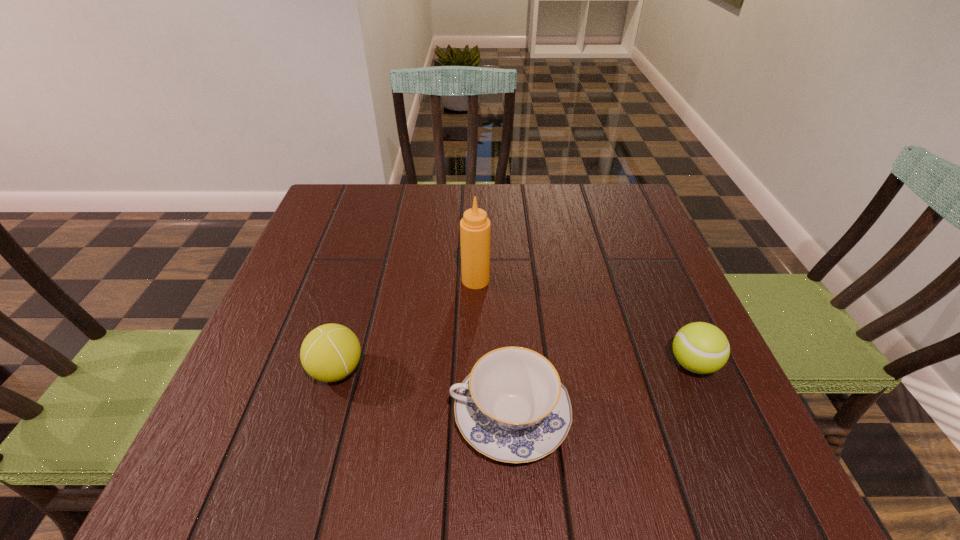
Locate an element on the screen. The image size is (960, 540). free region that satisfies the following two spatial constraints: 1. on the front side of the condiment; 2. with the handle on the side of the chinaware is located at coordinates (474, 415).

Where is `free location that satisfies the following two spatial constraints: 1. on the front side of the condiment; 2. on the right side of the rightmost object`? The width and height of the screenshot is (960, 540). free location that satisfies the following two spatial constraints: 1. on the front side of the condiment; 2. on the right side of the rightmost object is located at coordinates (475, 364).

Image resolution: width=960 pixels, height=540 pixels. Identify the location of free spot that satisfies the following two spatial constraints: 1. on the back side of the rightmost object; 2. on the left side of the left tennis ball. (339, 364).

Where is `vacant region that satisfies the following two spatial constraints: 1. on the back side of the leftmost object; 2. on the right side of the right tennis ball`? Image resolution: width=960 pixels, height=540 pixels. vacant region that satisfies the following two spatial constraints: 1. on the back side of the leftmost object; 2. on the right side of the right tennis ball is located at coordinates (339, 364).

Image resolution: width=960 pixels, height=540 pixels. I want to click on blank space that satisfies the following two spatial constraints: 1. with the handle on the side of the chinaware; 2. on the front side of the condiment, so click(x=502, y=280).

Locate an element on the screen. The height and width of the screenshot is (540, 960). vacant region that satisfies the following two spatial constraints: 1. on the front side of the farthest object; 2. with the handle on the side of the chinaware is located at coordinates (474, 415).

What are the coordinates of `vacant point that satisfies the following two spatial constraints: 1. with the handle on the side of the chinaware; 2. on the front side of the farthest object` in the screenshot? It's located at (502, 280).